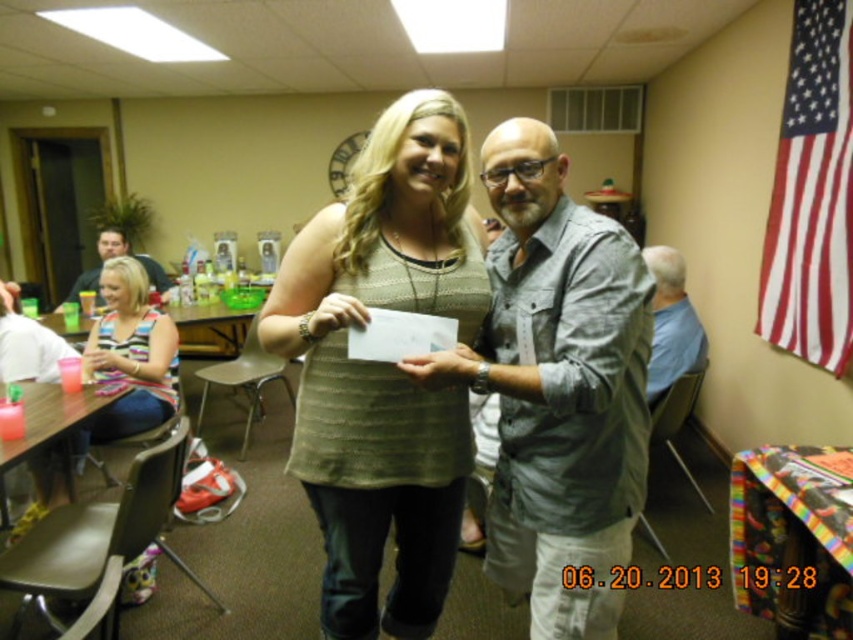
Question: Among these points, which one is farthest from the camera?

Choices:
 (A) (161, 362)
 (B) (670, 333)
 (C) (289, 260)
 (D) (85, 285)

Answer: (D)

Question: Does gray textured shirt at center lie behind blonde hair woman at center?

Choices:
 (A) no
 (B) yes

Answer: (A)

Question: Is green knitted sweater at center above gray textured shirt at center?

Choices:
 (A) no
 (B) yes

Answer: (B)

Question: Is striped fabric shirt at left to the right of blonde hair woman at center from the viewer's perspective?

Choices:
 (A) yes
 (B) no

Answer: (A)

Question: Which point appears farthest from the camera in this image?

Choices:
 (A) (123, 237)
 (B) (103, 266)
 (C) (670, 342)

Answer: (A)

Question: Which of the following is the closest to the observer?

Choices:
 (A) (161, 278)
 (B) (691, 314)

Answer: (B)